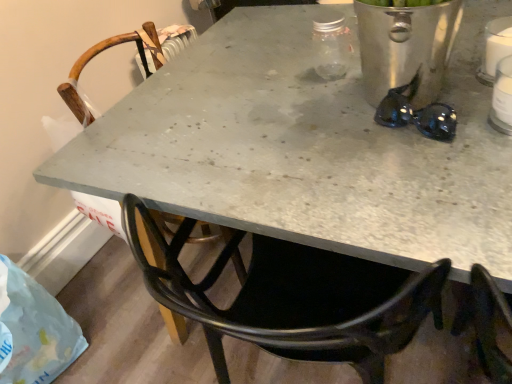
You are a GUI agent. You are given a task and a screenshot of the screen. Output one action in this format:
    pyautogui.click(x=<x>, y=<y>)
    Task: Click on the unoccupied region to the right of black shiny sunglasses at upper right
    
    Given the screenshot: What is the action you would take?
    pyautogui.click(x=462, y=94)